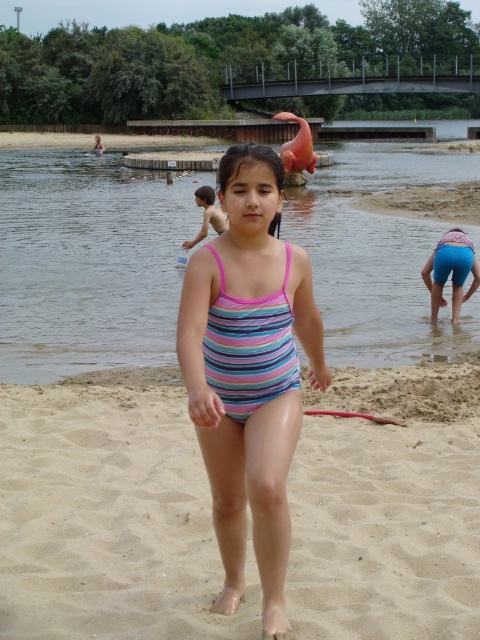
Is smooth sand at center wider than clear water at center?

Incorrect, smooth sand at center's width does not surpass clear water at center's.

Between smooth sand at center and clear water at center, which one has more height?

With more height is clear water at center.

The image size is (480, 640). In order to click on smooth sand at center in this screenshot , I will do `click(108, 515)`.

Based on the photo, does blue stretchy shorts at lower right lie behind pink striped swimsuit at center?

No.

Is blue stretchy shorts at lower right to the right of pink striped swimsuit at center from the viewer's perspective?

Correct, you'll find blue stretchy shorts at lower right to the right of pink striped swimsuit at center.

This screenshot has height=640, width=480. I want to click on blue stretchy shorts at lower right, so click(x=451, y=269).

Which is above, clear water at center or striped fabric swimsuit at center?

Positioned higher is clear water at center.

Is point (157, 321) positioned before point (241, 275)?

That is False.

Between point (103, 308) and point (202, 344), which one is positioned behind?

The point (103, 308) is more distant.

I want to click on clear water at center, so click(87, 262).